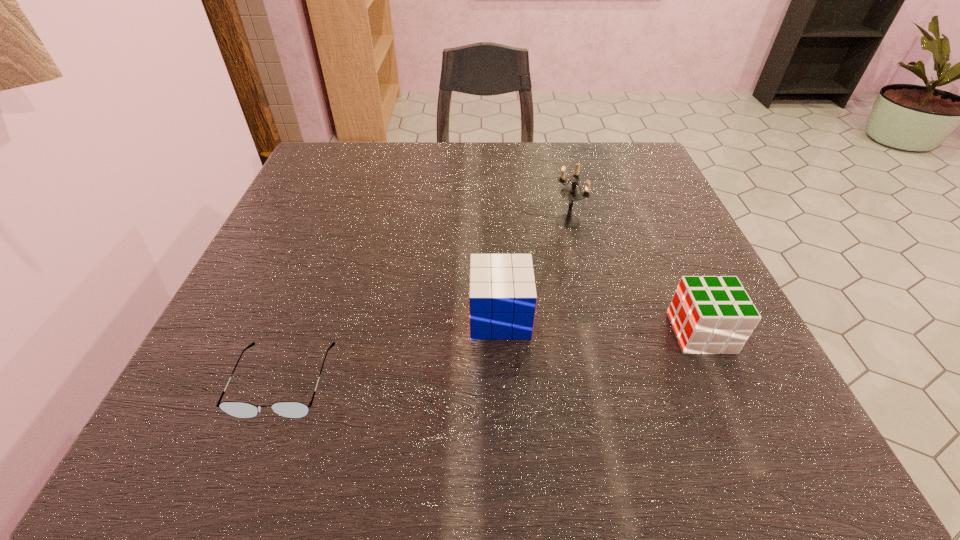
In order to click on the farthest object in this screenshot , I will do `click(572, 193)`.

At what (x,y) coordinates should I click in order to perform the action: click on candle holder. Please return your answer as a coordinate pair (x, y). The height and width of the screenshot is (540, 960). Looking at the image, I should click on (572, 193).

Where is `the second object from left to right`? the second object from left to right is located at coordinates point(502,297).

Identify the location of the right cube. (709, 314).

I want to click on the leftmost object, so click(291, 409).

Identify the location of spectacles. The height and width of the screenshot is (540, 960). (291, 409).

Locate an element on the screen. The image size is (960, 540). free space located on the back of the tallest object is located at coordinates (560, 185).

I want to click on vacant point located 0.090m on the right of the second object from left to right, so click(x=585, y=317).

You are a GUI agent. You are given a task and a screenshot of the screen. Output one action in this format:
    pyautogui.click(x=<x>, y=<y>)
    Task: Click on the free space located 0.280m on the red face of the rightmost object
    The image size is (960, 540).
    Given the screenshot: What is the action you would take?
    pyautogui.click(x=496, y=333)

You are a GUI agent. You are given a task and a screenshot of the screen. Output one action in this format:
    pyautogui.click(x=<x>, y=<y>)
    Task: Click on the vacant area located 0.200m on the red face of the rightmost object
    The height and width of the screenshot is (540, 960).
    Given the screenshot: What is the action you would take?
    pyautogui.click(x=547, y=333)